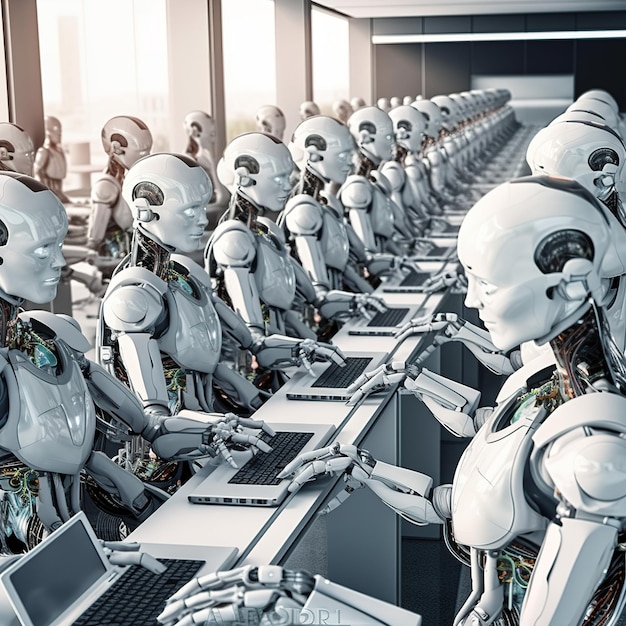
The height and width of the screenshot is (626, 626). I want to click on laptop, so click(x=439, y=248), click(x=422, y=278), click(x=386, y=321), click(x=355, y=371), click(x=283, y=464), click(x=135, y=588).